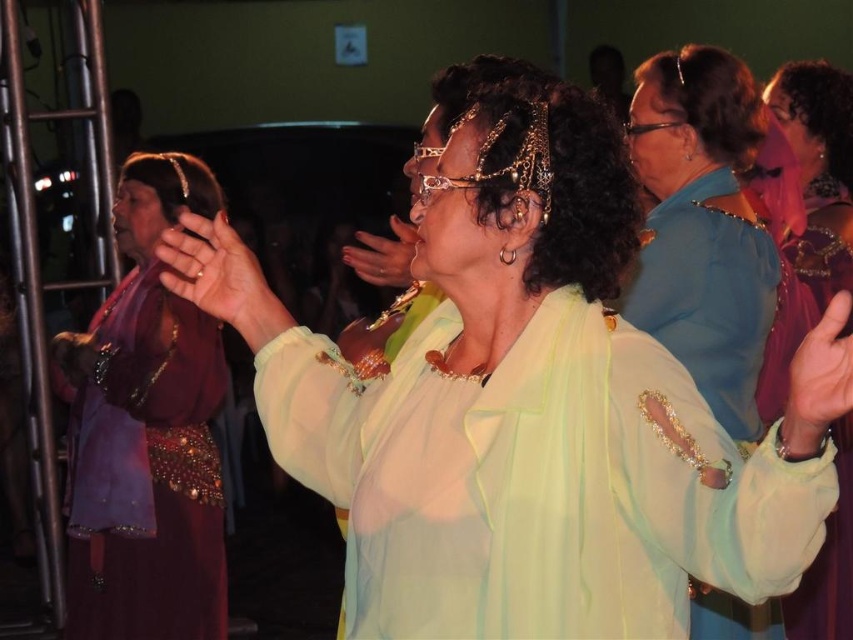
Which is behind, point (694, 262) or point (816, 61)?

The point (816, 61) is behind.

Does point (733, 88) lie behind point (813, 253)?

No, (733, 88) is in front of (813, 253).

Who is more distant from viewer, [689,177] or [848,602]?

Positioned behind is point [848,602].

At what (x,y) coordinates should I click in order to perform the action: click on blue satin blouse at center. Please return your answer as a coordinate pair (x, y). The width and height of the screenshot is (853, 640). Looking at the image, I should click on (701, 227).

Between shiny maroon dress at left and smooth skin hand at center, which one has more height?

shiny maroon dress at left

Can you confirm if shiny maroon dress at left is thinner than smooth skin hand at center?

In fact, shiny maroon dress at left might be wider than smooth skin hand at center.

Is point (138, 419) closer to viewer compared to point (846, 305)?

No, it is behind (846, 305).

Locate an element on the screen. Image resolution: width=853 pixels, height=640 pixels. shiny maroon dress at left is located at coordinates (146, 433).

Based on the photo, which of these two, blue satin blouse at center or matte gold ring at center, stands taller?

blue satin blouse at center is taller.

Which is more to the right, blue satin blouse at center or matte gold ring at center?

blue satin blouse at center

Between point (705, 595) and point (263, 332), which one is positioned in front?

Point (263, 332) is more forward.

Identify the location of blue satin blouse at center. pyautogui.click(x=701, y=227).